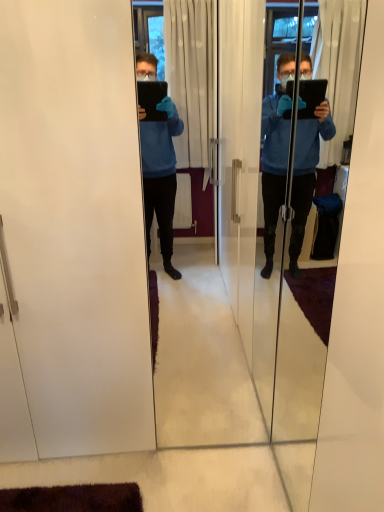
Question: Visually, is transparent glass tablet at center, which ranks as the first screen door in right-to-left order, positioned to the left or to the right of white matte screen door at left, placed as the second screen door when sorted from right to left?

Choices:
 (A) right
 (B) left

Answer: (A)

Question: From their relative heights in the image, would you say transparent glass tablet at center, which ranks as the first screen door in right-to-left order, is taller or shorter than white matte screen door at left, placed as the second screen door when sorted from right to left?

Choices:
 (A) tall
 (B) short

Answer: (B)

Question: Is point (276, 214) closer or farther from the camera than point (135, 206)?

Choices:
 (A) farther
 (B) closer

Answer: (A)

Question: From the image's perspective, is white matte screen door at left, the 1th screen door positioned from the left, located above or below transparent glass tablet at center, which is the 2th screen door from left to right?

Choices:
 (A) above
 (B) below

Answer: (A)

Question: In terms of size, does white matte screen door at left, the 1th screen door positioned from the left, appear bigger or smaller than transparent glass tablet at center, which is the 2th screen door from left to right?

Choices:
 (A) big
 (B) small

Answer: (A)

Question: Considering the positions of white matte screen door at left, the 1th screen door positioned from the left, and transparent glass tablet at center, which ranks as the first screen door in right-to-left order, in the image, is white matte screen door at left, the 1th screen door positioned from the left, taller or shorter than transparent glass tablet at center, which ranks as the first screen door in right-to-left order,?

Choices:
 (A) short
 (B) tall

Answer: (B)

Question: Visually, is white matte screen door at left, placed as the second screen door when sorted from right to left, positioned to the left or to the right of transparent glass tablet at center, which ranks as the first screen door in right-to-left order?

Choices:
 (A) left
 (B) right

Answer: (A)